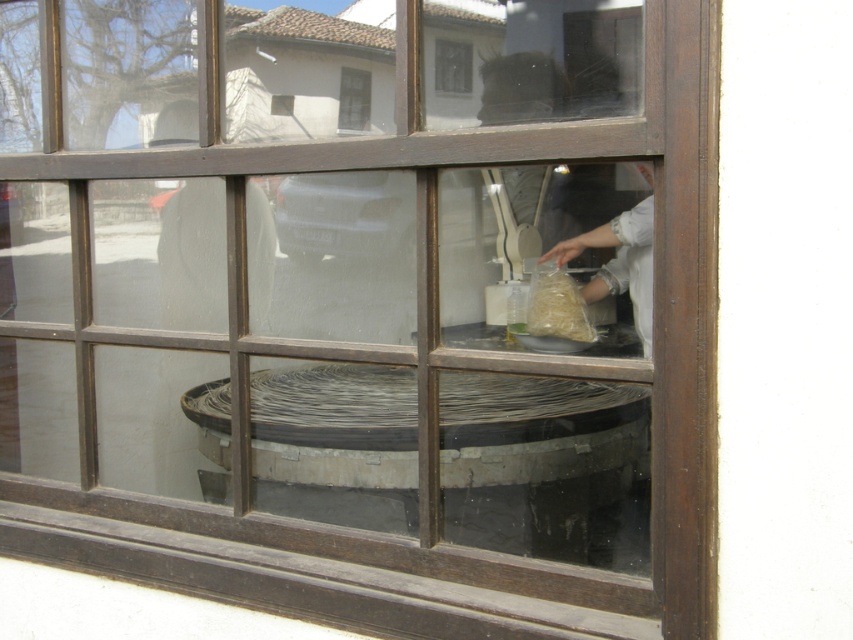
You are standing in the room and want to hang a picture frame on the wall behind the white fabric at center and the transparent glass window at center. Which object should you avoid placing the frame near to ensure it doesn

You should avoid placing the frame near the transparent glass window at center because the white fabric at center is below it, so the window is higher up and closer to where the frame would typically be hung.

You are a guest in the room and want to see the contents of the translucent paper bag at center. Can you see through the white fabric at center to the bag?

The white fabric at center is positioned over the translucent paper bag at center, so yes, you can see through the white fabric at center to the bag because the fabric is likely translucent or sheer.

You are standing in the room and see the white fabric at center and the transparent glass window at center. Which object is closer to your right side?

The white fabric at center is to the right of the transparent glass window at center, so it is closer to your right side.